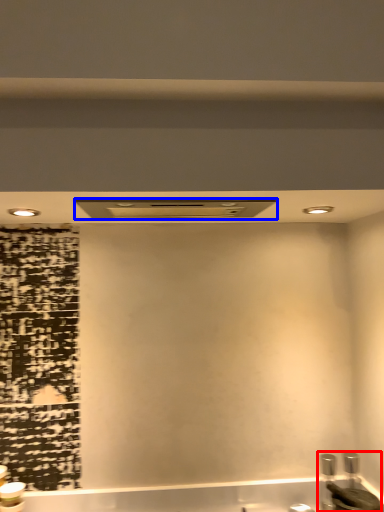
Question: Which object appears closest to the camera in this image, sink (highlighted by a red box) or exhaust hood (highlighted by a blue box)?

Choices:
 (A) sink
 (B) exhaust hood

Answer: (B)